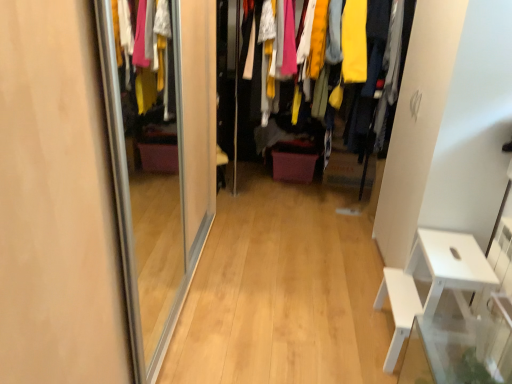
Question: From the image's perspective, does textured fabric clothes at center appear lower than white plastic table at right?

Choices:
 (A) yes
 (B) no

Answer: (B)

Question: Is textured fabric clothes at center smaller than white plastic table at right?

Choices:
 (A) yes
 (B) no

Answer: (B)

Question: Is textured fabric clothes at center shorter than white plastic table at right?

Choices:
 (A) no
 (B) yes

Answer: (A)

Question: From a real-world perspective, is textured fabric clothes at center located beneath white plastic table at right?

Choices:
 (A) no
 (B) yes

Answer: (A)

Question: Does textured fabric clothes at center have a greater height compared to white plastic table at right?

Choices:
 (A) no
 (B) yes

Answer: (B)

Question: From the image's perspective, is textured fabric clothes at center over white plastic table at right?

Choices:
 (A) yes
 (B) no

Answer: (A)

Question: Is white plastic table at right next to textured fabric clothes at center?

Choices:
 (A) no
 (B) yes

Answer: (A)

Question: Is white plastic table at right to the right of textured fabric clothes at center from the viewer's perspective?

Choices:
 (A) no
 (B) yes

Answer: (B)

Question: Considering the relative sizes of white plastic table at right and textured fabric clothes at center in the image provided, is white plastic table at right bigger than textured fabric clothes at center?

Choices:
 (A) yes
 (B) no

Answer: (B)

Question: Does white plastic table at right come in front of textured fabric clothes at center?

Choices:
 (A) yes
 (B) no

Answer: (A)

Question: Does white plastic table at right turn towards textured fabric clothes at center?

Choices:
 (A) no
 (B) yes

Answer: (A)

Question: Is white plastic table at right further to the viewer compared to textured fabric clothes at center?

Choices:
 (A) yes
 (B) no

Answer: (B)

Question: Looking at their shapes, would you say white plastic table at right is wider or thinner than textured fabric clothes at center?

Choices:
 (A) thin
 (B) wide

Answer: (A)